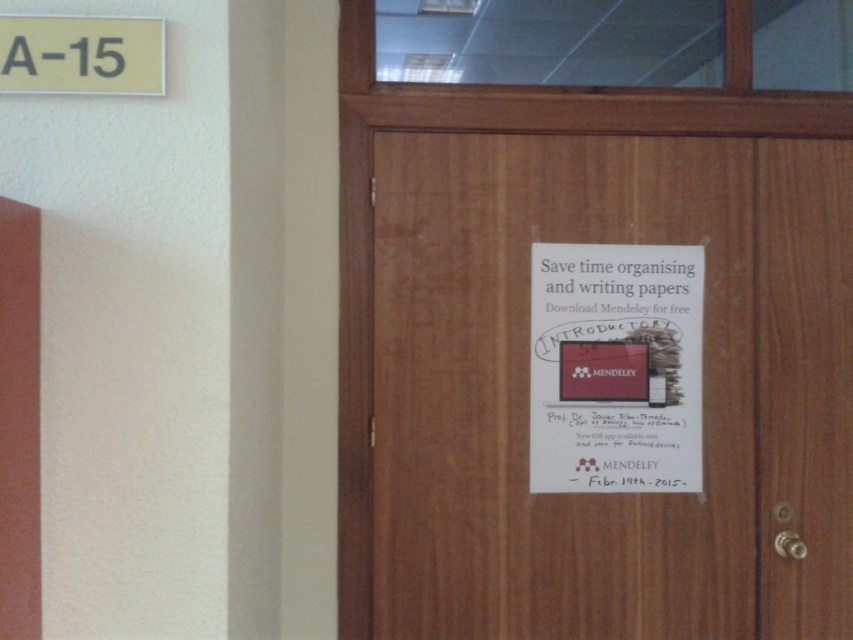
You are a visitor at a university campus and need to locate the room where the Mendeley Introductory Session is being held. You see the smooth wood door at left and the yellow plastic sign at upper left. Which object should you look at to find the session details?

The yellow plastic sign at upper left contains the session details, including the date and presenter information, so you should look at the yellow plastic sign at upper left.

You are standing in a hallway and see the smooth wood door at left. If you want to walk towards it, which direction should you move?

Since the smooth wood door at left is located at point [19,420], you should move to the left to reach it.

You are standing in a hallway with two doors. You need to enter the taller door. Which one should you choose between the wooden door at center and the smooth wood door at left?

The wooden door at center is much taller than the smooth wood door at left, so you should choose the wooden door at center.